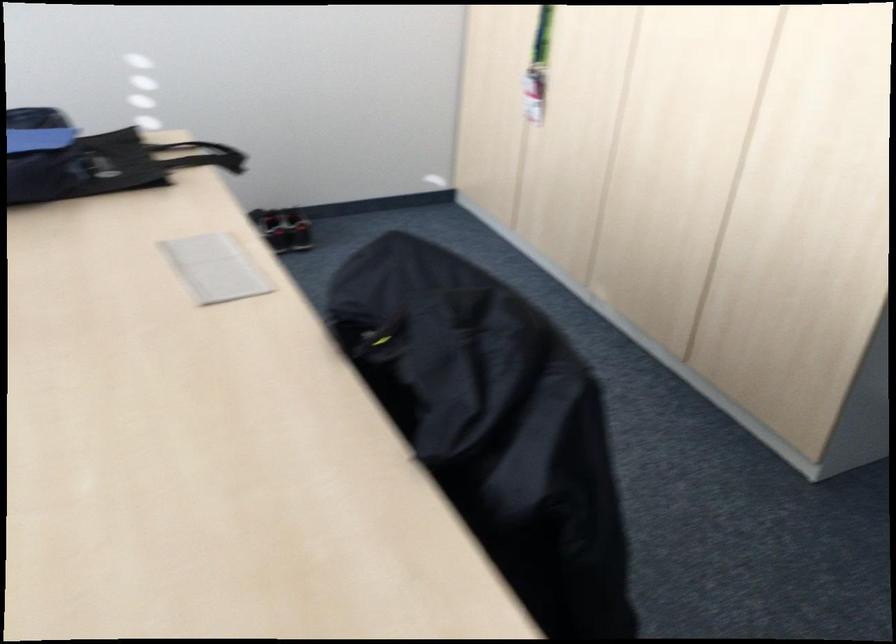
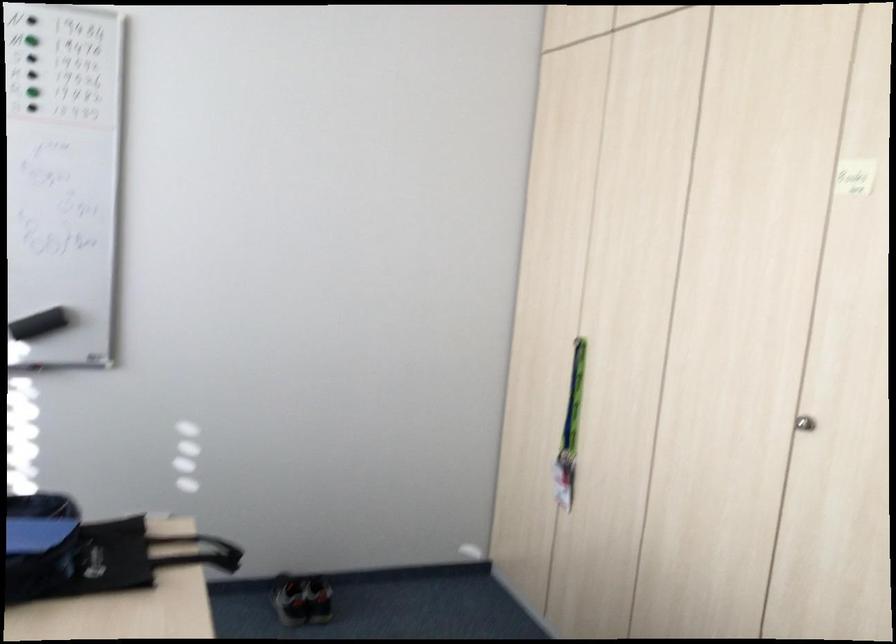
Locate, in the second image, the point that corresponds to point (271, 231) in the first image.

(289, 599)